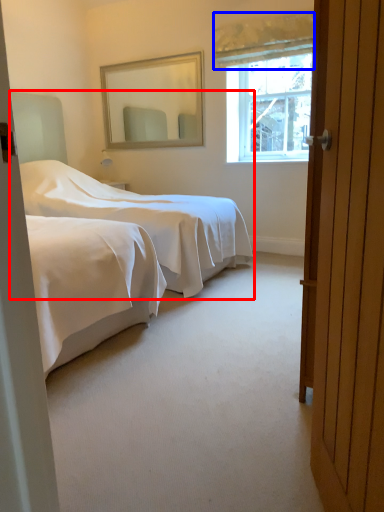
Question: Which of the following is the closest to the observer, bed (highlighted by a red box) or curtain (highlighted by a blue box)?

Choices:
 (A) bed
 (B) curtain

Answer: (A)